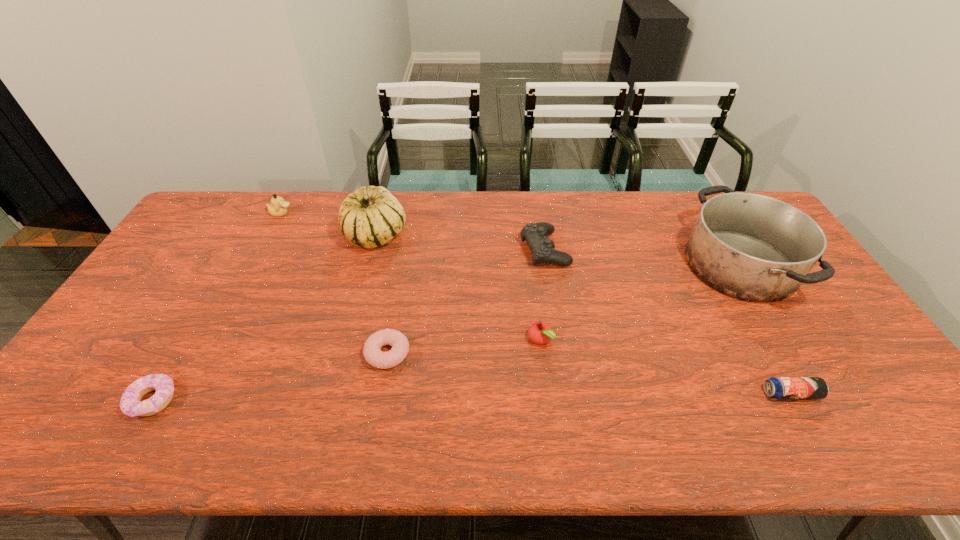
The height and width of the screenshot is (540, 960). Find the location of `free space that satisfies the following two spatial constraints: 1. on the back side of the nearer doughnut; 2. on the right side of the apple`. free space that satisfies the following two spatial constraints: 1. on the back side of the nearer doughnut; 2. on the right side of the apple is located at coordinates (188, 340).

The height and width of the screenshot is (540, 960). What are the coordinates of `vacant region that satisfies the following two spatial constraints: 1. on the back side of the nearer doughnut; 2. on the right side of the gourd` in the screenshot? It's located at (249, 235).

Image resolution: width=960 pixels, height=540 pixels. In order to click on vacant space that satisfies the following two spatial constraints: 1. on the front side of the apple; 2. on the left side of the beer can in this screenshot , I will do `click(546, 394)`.

Locate an element on the screen. The image size is (960, 540). free region that satisfies the following two spatial constraints: 1. on the back side of the gourd; 2. on the left side of the nearer doughnut is located at coordinates (249, 235).

This screenshot has width=960, height=540. Identify the location of free region that satisfies the following two spatial constraints: 1. on the face of the duckling; 2. on the right side of the saucepan. (254, 265).

Identify the location of vacant space that satisfies the following two spatial constraints: 1. on the face of the duckling; 2. on the back side of the gourd. (270, 235).

The width and height of the screenshot is (960, 540). In order to click on blank area in the image that satisfies the following two spatial constraints: 1. on the back side of the left doughnut; 2. on the right side of the gourd in this screenshot , I will do `click(249, 235)`.

Locate an element on the screen. The width and height of the screenshot is (960, 540). free space that satisfies the following two spatial constraints: 1. on the face of the duckling; 2. on the right side of the apple is located at coordinates (215, 340).